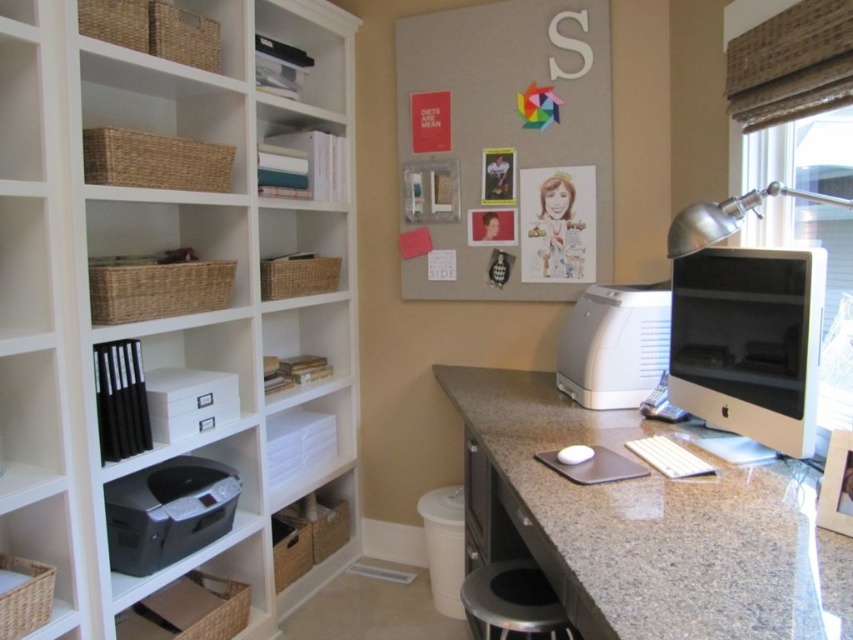
Question: Which point is closer to the camera taking this photo?

Choices:
 (A) (165, 515)
 (B) (695, 380)

Answer: (B)

Question: Does granite desk at lower right appear on the left side of matte gray bulletin board at upper center?

Choices:
 (A) no
 (B) yes

Answer: (A)

Question: Where is white glossy computer monitor at right located in relation to matte gray printer at center in the image?

Choices:
 (A) right
 (B) left

Answer: (A)

Question: Which object is farther from the camera taking this photo?

Choices:
 (A) matte black printer at lower left
 (B) matte gray bulletin board at upper center
 (C) metallic silver stool at lower center

Answer: (B)

Question: Where is granite desk at lower right located in relation to matte gray printer at center in the image?

Choices:
 (A) below
 (B) above

Answer: (A)

Question: Considering the real-world distances, which object is closest to the white glossy computer monitor at right?

Choices:
 (A) metallic silver stool at lower center
 (B) silver metallic desk lamp at upper right
 (C) matte black printer at lower left
 (D) white wood bookshelf at left

Answer: (B)